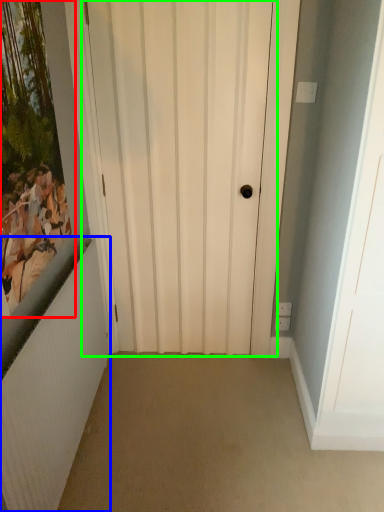
Question: Which object is the farthest from picture frame (highlighted by a red box)? Choose among these: radiator (highlighted by a blue box) or door (highlighted by a green box).

Choices:
 (A) radiator
 (B) door

Answer: (B)